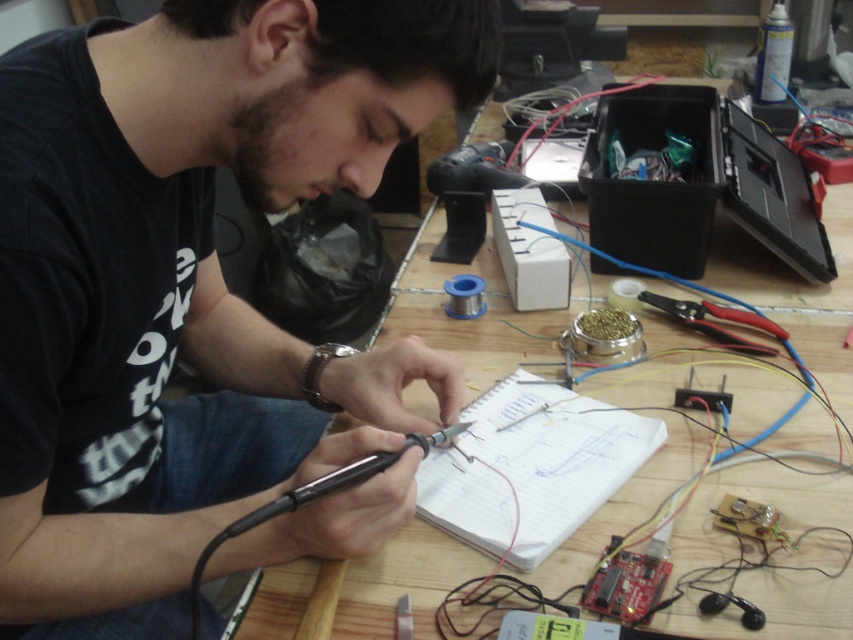
Between wooden table at center and red plastic pliers at center right, which one appears on the right side from the viewer's perspective?

From the viewer's perspective, red plastic pliers at center right appears more on the right side.

Where is `wooden table at center`? Image resolution: width=853 pixels, height=640 pixels. wooden table at center is located at coordinates (360, 589).

Find the location of a particular element. wooden table at center is located at coordinates (360, 589).

What are the coordinates of `wooden table at center` in the screenshot? It's located at (360, 589).

How far apart are white paper at center and red plastic pliers at center right?

12.69 inches

Is white paper at center smaller than red plastic pliers at center right?

No, white paper at center is not smaller than red plastic pliers at center right.

Who is more distant from viewer, [508,545] or [779,339]?

Point [779,339]

The width and height of the screenshot is (853, 640). I want to click on white paper at center, so click(x=531, y=467).

Is wooden table at center below white paper at center?

No.

Who is more forward, (799, 298) or (476, 404)?

Point (476, 404) is more forward.

The height and width of the screenshot is (640, 853). What are the coordinates of `wooden table at center` in the screenshot? It's located at (360, 589).